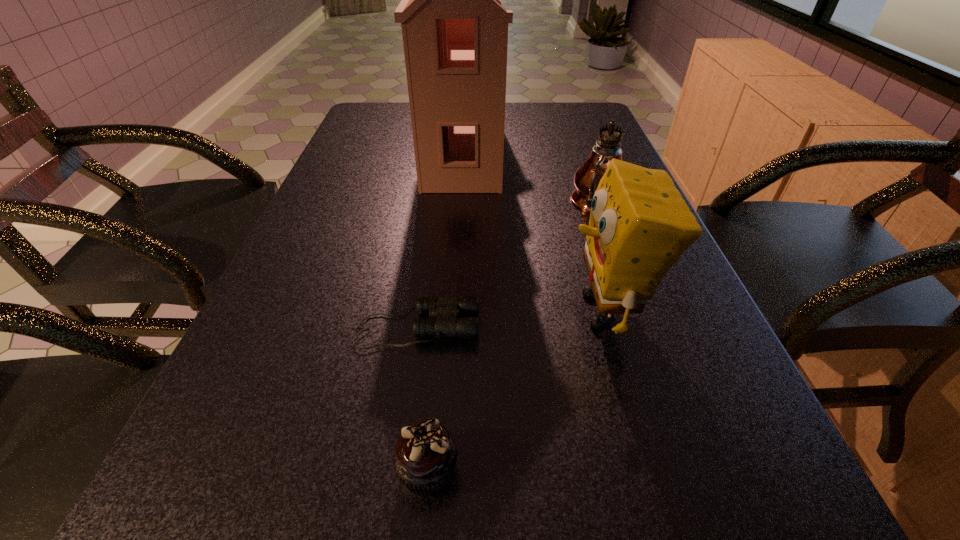
Where is `vacant point located between the shortest object and the sponge`? The image size is (960, 540). vacant point located between the shortest object and the sponge is located at coordinates (511, 319).

At what (x,y) coordinates should I click in order to perform the action: click on free spot between the third shortest object and the nearest object. Please return your answer as a coordinate pair (x, y). The image size is (960, 540). Looking at the image, I should click on (516, 390).

The image size is (960, 540). I want to click on vacant area between the dollhouse and the sponge, so click(x=534, y=230).

Locate an element on the screen. The height and width of the screenshot is (540, 960). vacant space in between the sponge and the tallest object is located at coordinates (534, 230).

Where is `free point between the shortest object and the tallest object`? Image resolution: width=960 pixels, height=540 pixels. free point between the shortest object and the tallest object is located at coordinates click(x=440, y=239).

Where is `free space between the tallest object and the binoculars`? free space between the tallest object and the binoculars is located at coordinates (440, 239).

Where is `vacant area that lies between the shortest object and the dollhouse`? The width and height of the screenshot is (960, 540). vacant area that lies between the shortest object and the dollhouse is located at coordinates (440, 239).

Select which object is the fourth closest to the second tallest object. Please provide its 2D coordinates. Your answer should be formatted as a tuple, i.e. [(x, y)], where the tuple contains the x and y coordinates of a point satisfying the conditions above.

[(424, 459)]

Where is `object that stands as the closest to the second tallest object`? Image resolution: width=960 pixels, height=540 pixels. object that stands as the closest to the second tallest object is located at coordinates (455, 31).

Where is `vacant area in the image that satisfies the following two spatial constraints: 1. on the back side of the second shortest object; 2. at the eyepiece of the shortest object`? The image size is (960, 540). vacant area in the image that satisfies the following two spatial constraints: 1. on the back side of the second shortest object; 2. at the eyepiece of the shortest object is located at coordinates (441, 327).